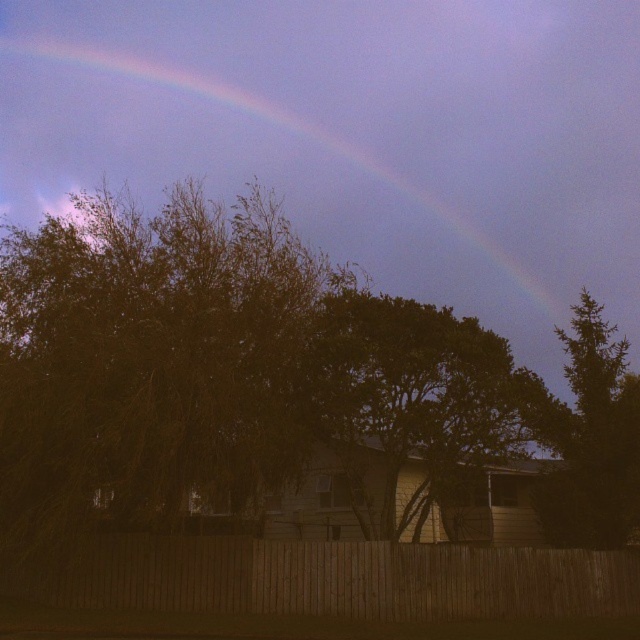
Is green leafy tree at center bigger than green leafy tree at upper right?

Actually, green leafy tree at center might be smaller than green leafy tree at upper right.

Does point (348, 435) come in front of point (618, 465)?

Yes, it is in front of point (618, 465).

Find the location of a particular element. Image resolution: width=640 pixels, height=640 pixels. green leafy tree at center is located at coordinates (417, 392).

In the scene shown: Is rainbow at upper center to the right of green leafy tree at upper right from the viewer's perspective?

Incorrect, rainbow at upper center is not on the right side of green leafy tree at upper right.

Is point (413, 192) positioned before point (612, 346)?

No.

Describe the element at coordinates (296, 157) in the screenshot. I see `rainbow at upper center` at that location.

I want to click on rainbow at upper center, so click(296, 157).

Does rainbow at upper center have a greater width compared to wooden fence at lower center?

Correct, the width of rainbow at upper center exceeds that of wooden fence at lower center.

Is point (289, 173) farther from camera compared to point (170, 586)?

Yes, point (289, 173) is behind point (170, 586).

What do you see at coordinates (296, 157) in the screenshot? I see `rainbow at upper center` at bounding box center [296, 157].

The height and width of the screenshot is (640, 640). I want to click on rainbow at upper center, so click(296, 157).